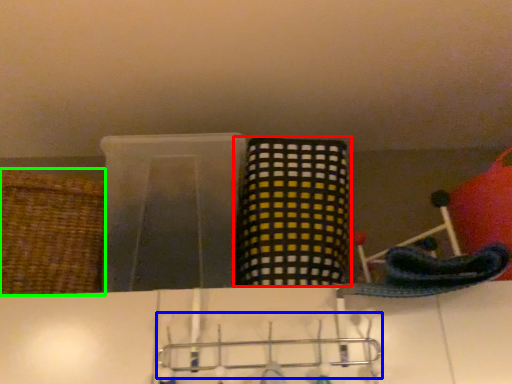
Question: Considering the real-world distances, which object is farthest from basket (highlighted by a red box)? hanger (highlighted by a blue box) or basket (highlighted by a green box)?

Choices:
 (A) hanger
 (B) basket

Answer: (B)